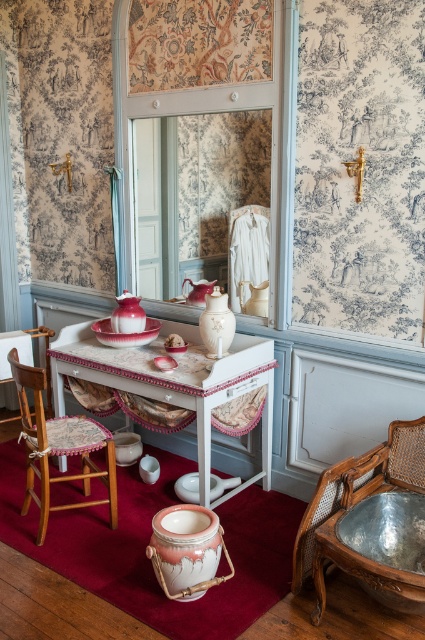
You are a guest in this room and need to choose between the wooden cane armchair at lower right and the wooden chair with cushion at left. Which chair is shorter?

The wooden cane armchair at lower right is shorter than the wooden chair with cushion at left.

Based on the photo, you are standing in the room and want to sit down. Which chair, the wooden cane armchair at lower right or the wooden chair with cushion at left, is closer to you?

The wooden cane armchair at lower right is closer to you because it is positioned under the wooden chair with cushion at left, meaning it is in front of it from your perspective.